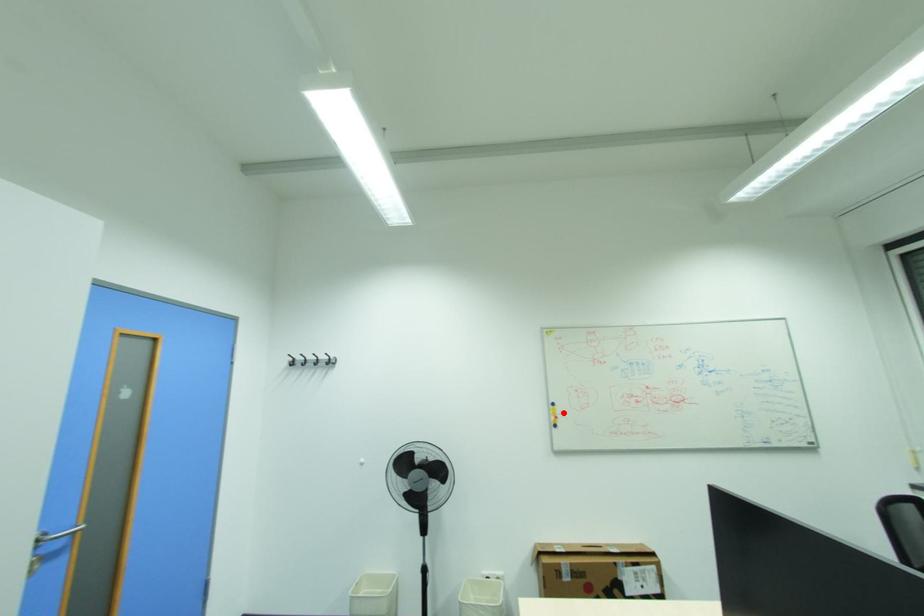
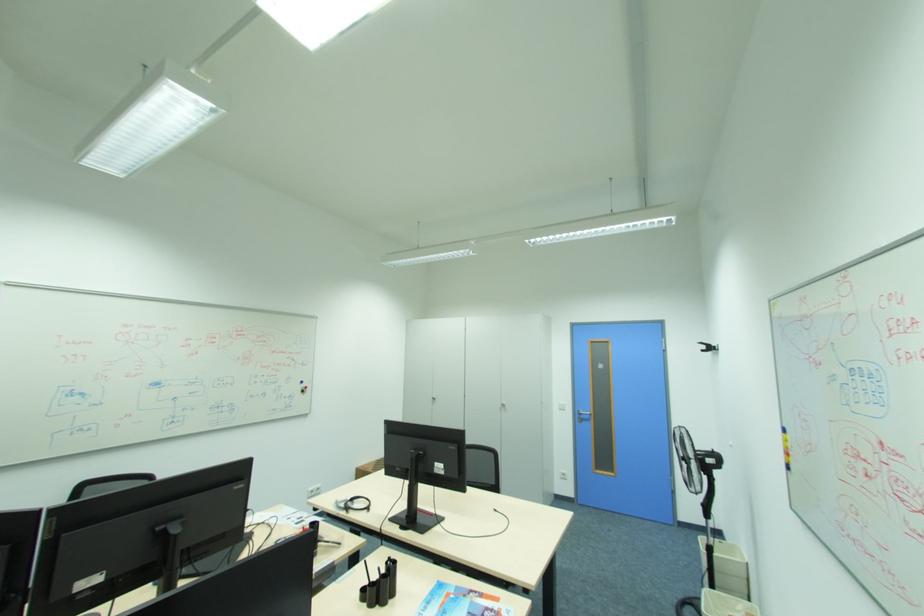
The point at the highlighted location is marked in the first image. Where is the corresponding point in the second image?

(794, 446)